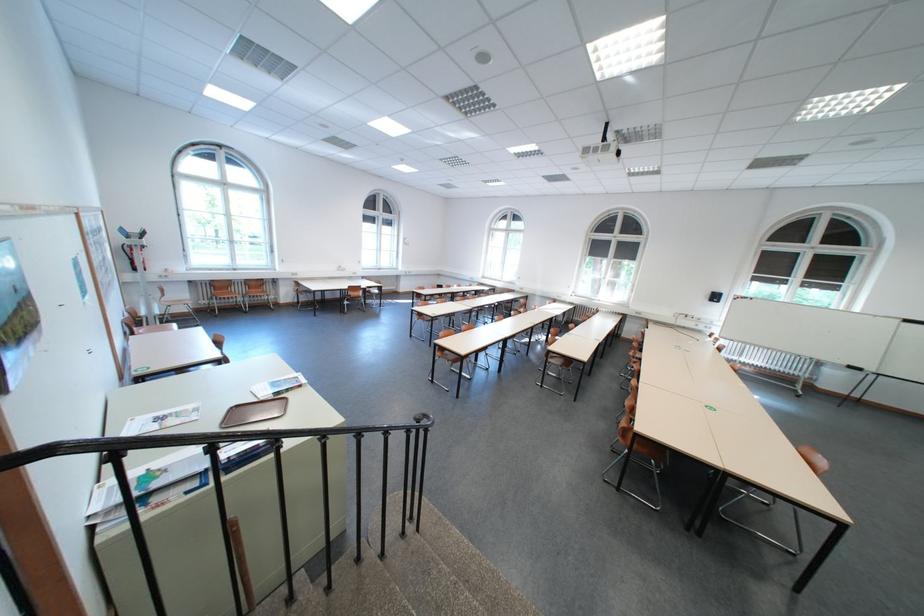
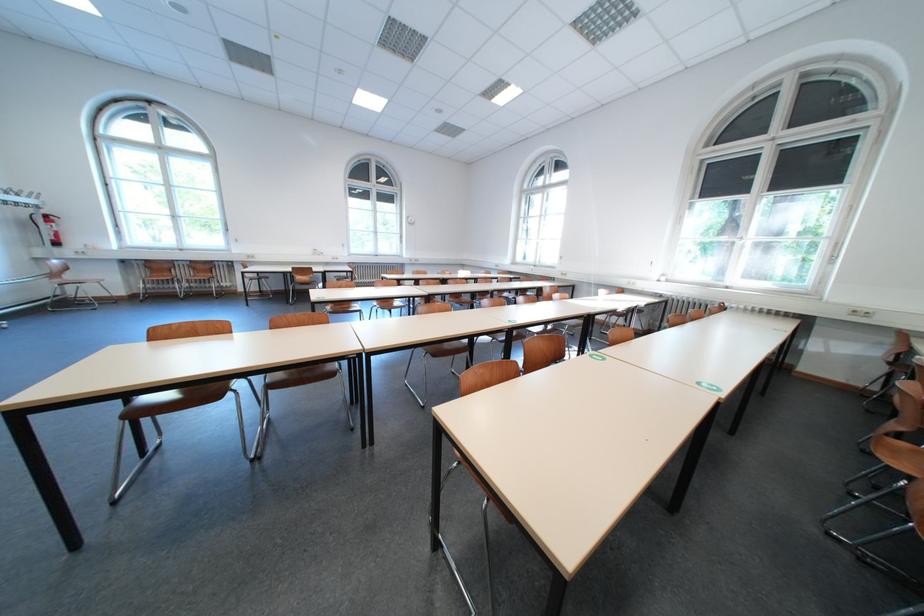
Consider the image. Which direction would the cameraman need to move to produce the second image?

The cameraman moved toward right, forward.